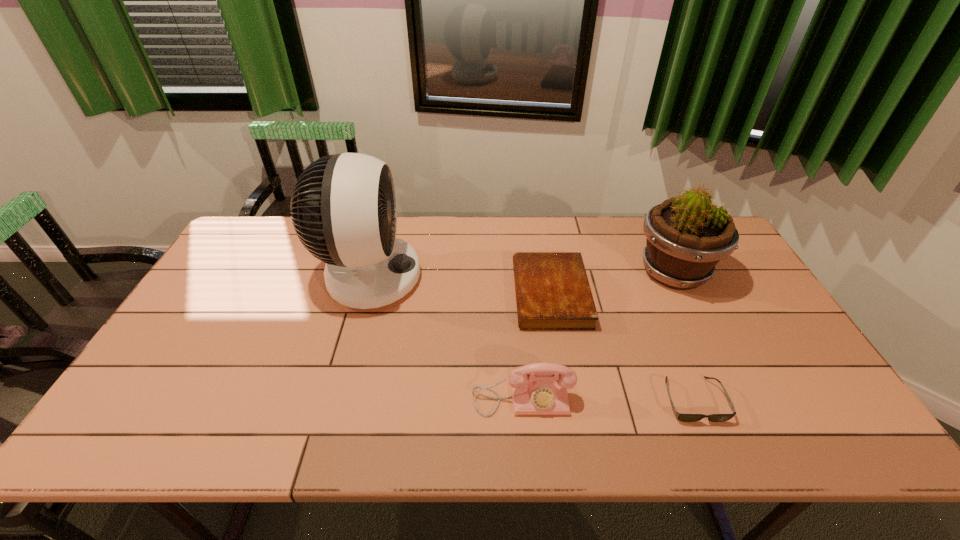
Find the location of a particular element. the leftmost object is located at coordinates (344, 212).

Locate an element on the screen. flowerpot is located at coordinates (687, 235).

Locate an element on the screen. Image resolution: width=960 pixels, height=540 pixels. telephone is located at coordinates (540, 388).

Find the location of `the fourth tallest object`. the fourth tallest object is located at coordinates (552, 289).

This screenshot has width=960, height=540. In order to click on the shortest object in this screenshot , I will do `click(681, 417)`.

Find the location of `free space located on the grille of the leftmost object`. free space located on the grille of the leftmost object is located at coordinates coord(530,277).

You are a GUI agent. You are given a task and a screenshot of the screen. Output one action in this format:
    pyautogui.click(x=<x>, y=<y>)
    Task: Click on the free space located on the back of the flowerpot
    This screenshot has height=540, width=960.
    Given the screenshot: What is the action you would take?
    pyautogui.click(x=651, y=225)

Where is `free space located 0.050m on the dial of the telephone`? This screenshot has height=540, width=960. free space located 0.050m on the dial of the telephone is located at coordinates (525, 438).

Where is `vacant area located on the spine side of the Bible`? vacant area located on the spine side of the Bible is located at coordinates (401, 294).

At what (x,y) coordinates should I click in order to perform the action: click on vacant space positioned 0.220m on the spine side of the Bible. Please return your answer as a coordinate pair (x, y). Image resolution: width=960 pixels, height=540 pixels. Looking at the image, I should click on (442, 294).